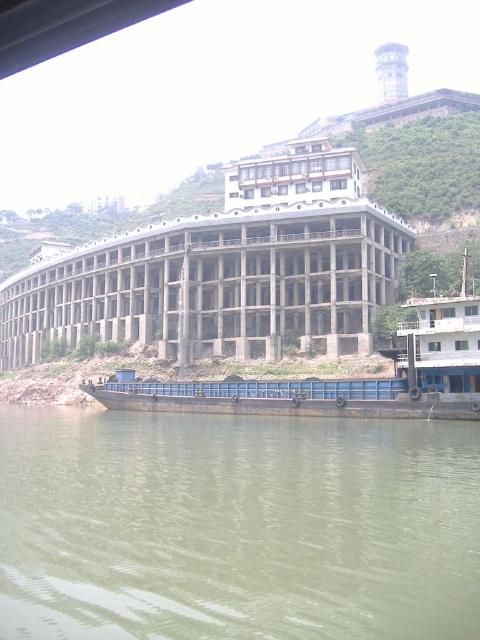
You are a delivery truck driver who needs to cross the green murky water at lower center to reach the rusty metal barge at lower right. Based on the scene, can your truck safely cross the water? Explain your reasoning.

The green murky water at lower center has a width that is less than the rusty metal barge at lower right. However, the scene does not provide information about the depth or stability of the water, so it is uncertain if the truck can safely cross.